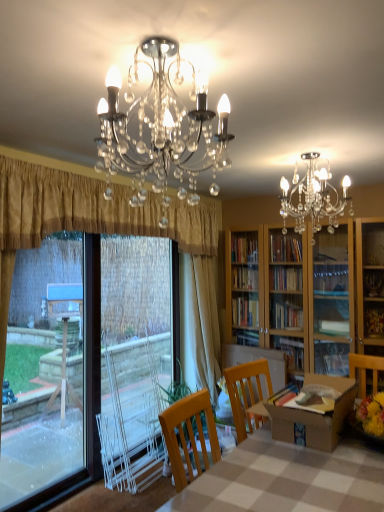
The height and width of the screenshot is (512, 384). I want to click on vacant space in front of brown cardboard box at center, so click(331, 476).